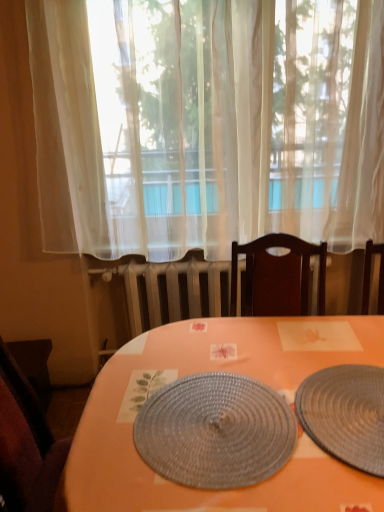
The width and height of the screenshot is (384, 512). I want to click on free spot below rattan placemat at center, acting as the second plate starting from the left (from a real-world perspective), so click(x=354, y=413).